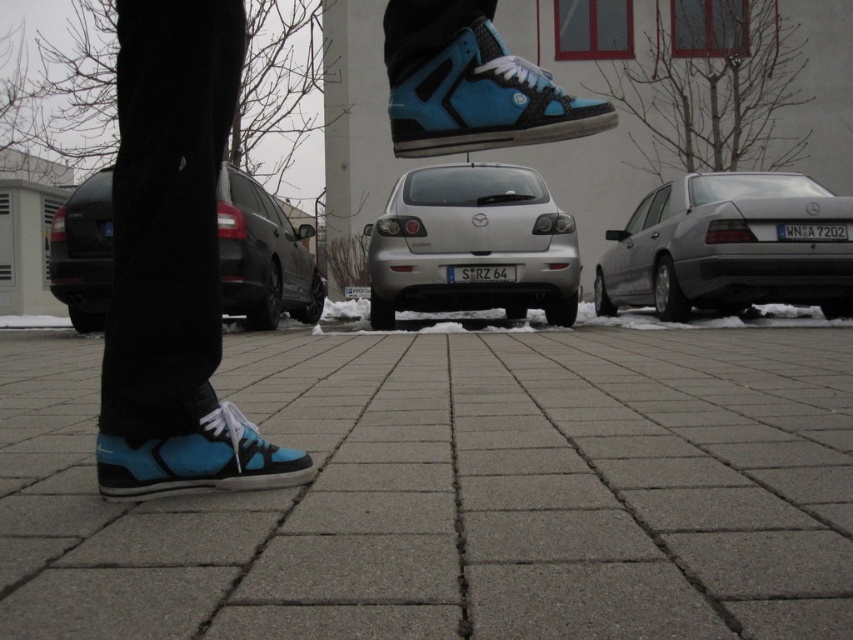
Question: Is gray concrete pavement at lower center to the left of matte blue canvas shoe at lower left from the viewer's perspective?

Choices:
 (A) no
 (B) yes

Answer: (A)

Question: Among these points, which one is nearest to the camera?

Choices:
 (A) (126, 131)
 (B) (42, 504)
 (C) (67, 259)

Answer: (A)

Question: Can you confirm if silver metallic hatchback at center is positioned above black matte car at center?

Choices:
 (A) no
 (B) yes

Answer: (B)

Question: Is silver metallic hatchback at center to the right of black matte car at center from the viewer's perspective?

Choices:
 (A) yes
 (B) no

Answer: (A)

Question: Among these objects, which one is farthest from the camera?

Choices:
 (A) matte blue sneaker at lower left
 (B) gray concrete pavement at lower center
 (C) black matte car at center

Answer: (C)

Question: Which point is farther to the camera?

Choices:
 (A) (125, 403)
 (B) (256, 328)
 (C) (231, 417)

Answer: (B)